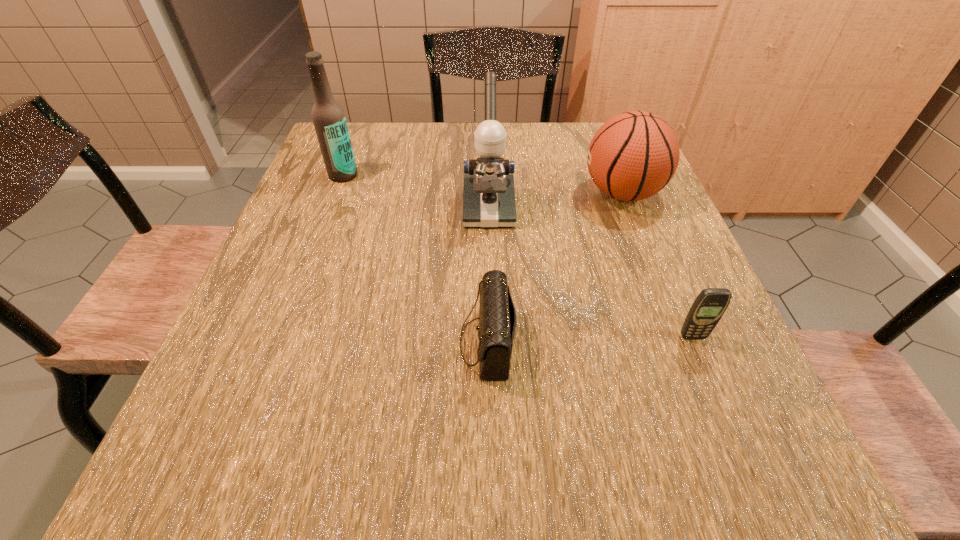
In the image, there is a desktop. What are the coordinates of `vacant region at the left edge` in the screenshot? It's located at (364, 168).

You are a GUI agent. You are given a task and a screenshot of the screen. Output one action in this format:
    pyautogui.click(x=<x>, y=<y>)
    Task: Click on the vacant space at the right edge
    This screenshot has width=960, height=540.
    Given the screenshot: What is the action you would take?
    pyautogui.click(x=684, y=314)

In the image, there is a desktop. Identify the location of vacant space at the far right corner. (578, 123).

Find the location of `vacant point located between the cellular telephone and the leftmost object`. vacant point located between the cellular telephone and the leftmost object is located at coordinates (517, 256).

Locate an element on the screen. This screenshot has height=540, width=960. free space that is in between the shortest object and the cellular telephone is located at coordinates (589, 340).

This screenshot has width=960, height=540. Find the location of `free area in between the fourth tallest object and the beer bottle`. free area in between the fourth tallest object and the beer bottle is located at coordinates (517, 256).

The width and height of the screenshot is (960, 540). I want to click on vacant area between the microscope and the leftmost object, so click(416, 192).

Find the location of a particular element. This screenshot has width=960, height=540. empty location between the microscope and the basketball is located at coordinates (x=555, y=201).

Locate an element on the screen. This screenshot has width=960, height=540. free space between the microscope and the beer bottle is located at coordinates point(416,192).

This screenshot has height=540, width=960. Identify the location of free space between the leftmost object and the microscope. (416, 192).